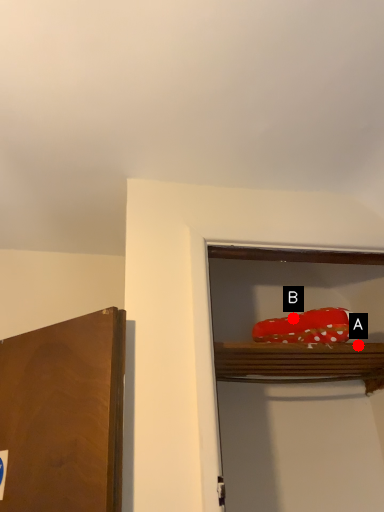
Question: Two points are circled on the image, labeled by A and B beside each circle. Which point is closer to the camera taking this photo?

Choices:
 (A) A is closer
 (B) B is closer

Answer: (A)